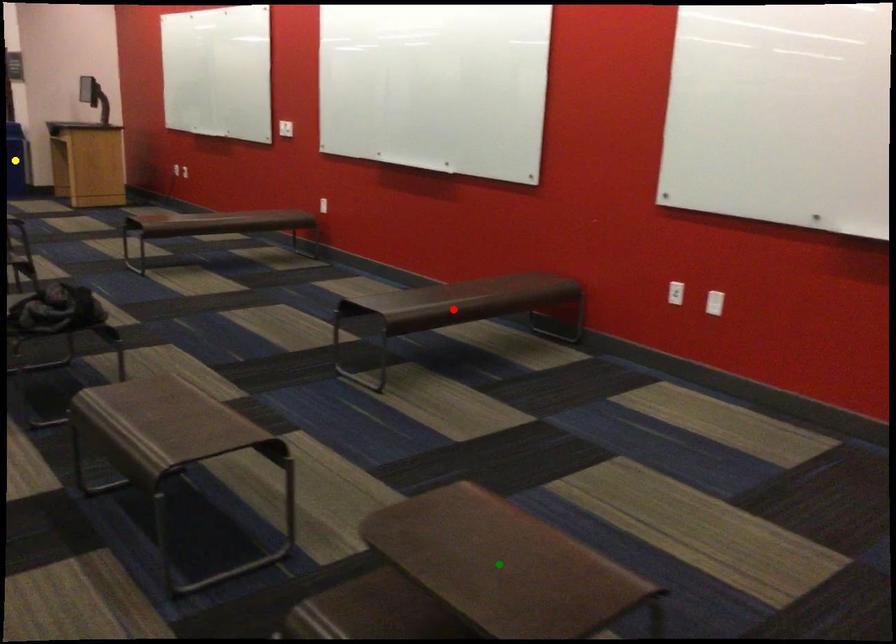
Order these from farthest to nearest:
- green point
- red point
- yellow point

yellow point
red point
green point